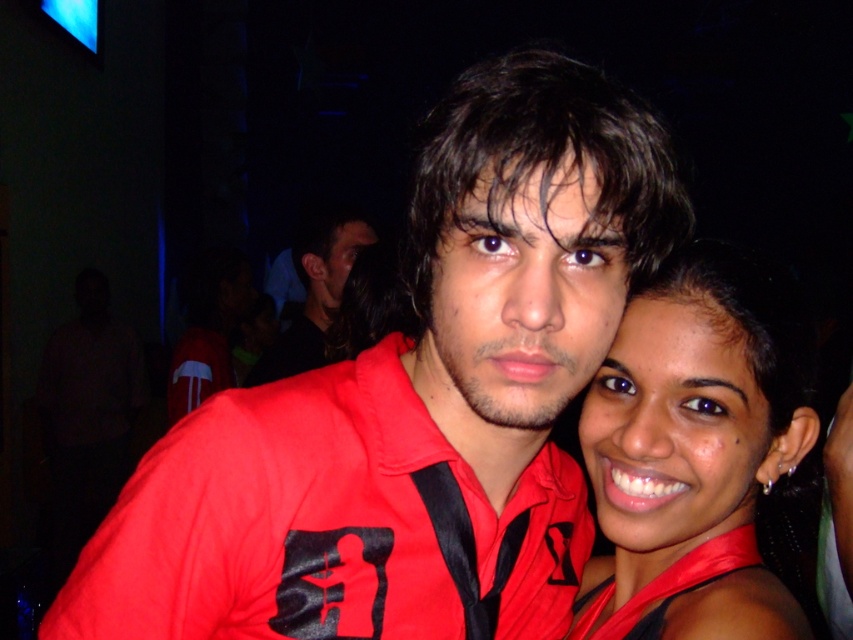
Question: Does matte red shirt at center have a smaller size compared to matte black shirt at center?

Choices:
 (A) yes
 (B) no

Answer: (A)

Question: Among these objects, which one is nearest to the camera?

Choices:
 (A) matte red shirt at center
 (B) matte black shirt at center

Answer: (A)

Question: Considering the relative positions of matte red shirt at center and satin red dress at right in the image provided, where is matte red shirt at center located with respect to satin red dress at right?

Choices:
 (A) above
 (B) below

Answer: (A)

Question: Does matte red shirt at center lie behind matte black shirt at center?

Choices:
 (A) no
 (B) yes

Answer: (A)

Question: Which object is closer to the camera taking this photo?

Choices:
 (A) matte black shirt at center
 (B) satin red dress at right
 (C) matte red shirt at center

Answer: (C)

Question: Which object is closer to the camera taking this photo?

Choices:
 (A) matte black shirt at center
 (B) satin red dress at right
 (C) matte red shirt at center

Answer: (C)